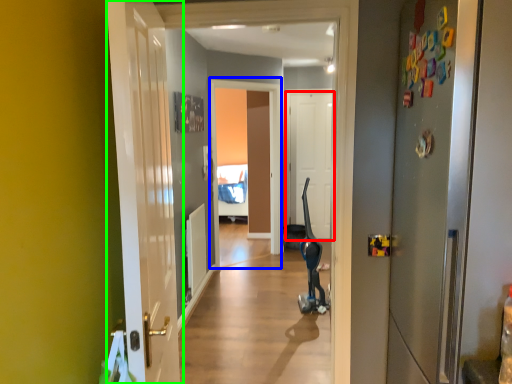
Question: Which object is the closest to the door (highlighted by a red box)? Choose among these: screen door (highlighted by a blue box) or door (highlighted by a green box).

Choices:
 (A) screen door
 (B) door

Answer: (A)